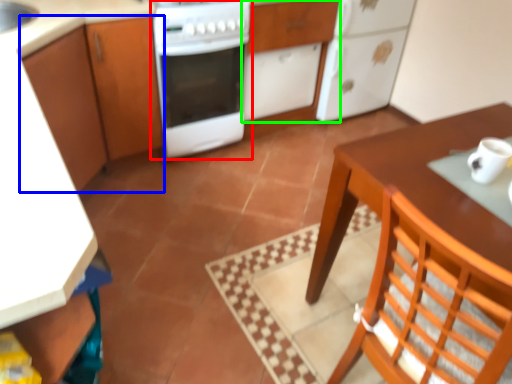
Question: Which object is the farthest from home appliance (highlighted by a red box)? Choose among these: cabinetry (highlighted by a blue box) or cabinetry (highlighted by a green box).

Choices:
 (A) cabinetry
 (B) cabinetry

Answer: (B)